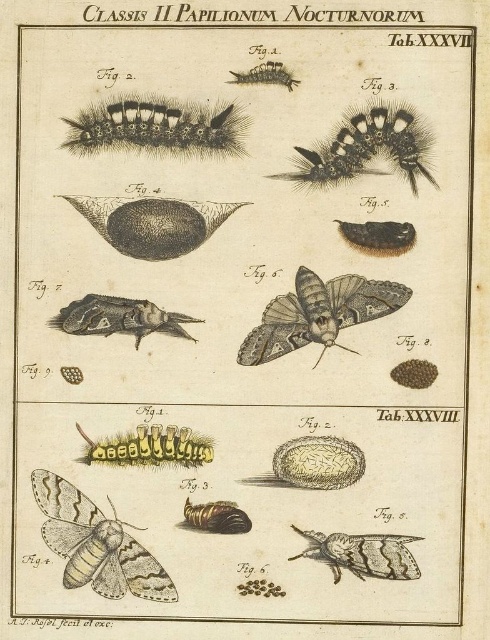
Question: Can you confirm if brown fuzzy caterpillar at center is positioned to the right of black fuzzy caterpillar at upper center?

Choices:
 (A) no
 (B) yes

Answer: (A)

Question: Which object is the closest to the yellow fuzzy caterpillar at center?

Choices:
 (A) matte black insect at center-left
 (B) grayish-brown moth at center

Answer: (A)

Question: Is hairy brown caterpillar at upper center thinner than matte black insect at center-left?

Choices:
 (A) no
 (B) yes

Answer: (A)

Question: Which object appears closest to the camera in this image?

Choices:
 (A) brown fuzzy caterpillar at center
 (B) matte black insect at center-left
 (C) grayish-brown moth at center

Answer: (B)

Question: Among these points, which one is farthest from the camera?

Choices:
 (A) (167, 461)
 (B) (287, 74)

Answer: (B)

Question: Is shiny brown caterpillar at center bigger than shiny metallic caterpillar at upper center?

Choices:
 (A) yes
 (B) no

Answer: (B)